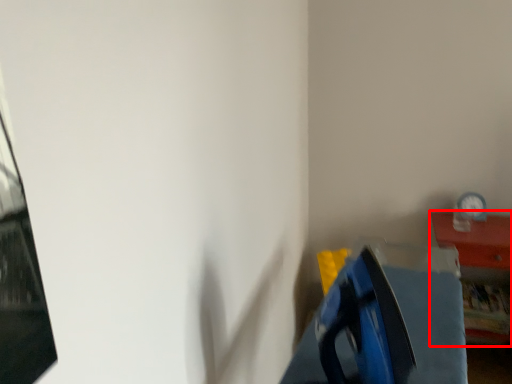
Question: From the image's perspective, what is the correct spatial positioning of furniture (annotated by the red box) in reference to clock?

Choices:
 (A) above
 (B) below

Answer: (B)